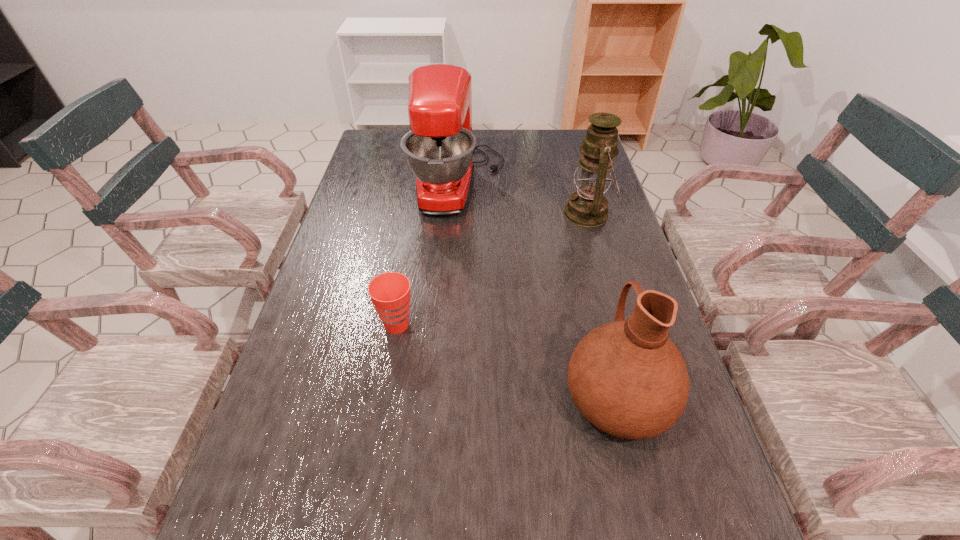
The image size is (960, 540). Identify the location of kitchen mixer. (439, 149).

The image size is (960, 540). What are the coordinates of `oil lamp` in the screenshot? It's located at (587, 207).

Find the location of a particular element. The width and height of the screenshot is (960, 540). pitcher is located at coordinates (627, 378).

I want to click on the shortest object, so click(390, 293).

Find the location of a particular element. cup is located at coordinates (390, 293).

Find the location of a particular element. This screenshot has height=540, width=960. vacant region located on the front-facing side of the kitchen mixer is located at coordinates pyautogui.click(x=598, y=184).

Locate an element on the screen. The height and width of the screenshot is (540, 960). free spot located on the front of the oil lamp is located at coordinates click(x=599, y=252).

Find the location of `vacant space located on the side of the pitcher with the handle`. vacant space located on the side of the pitcher with the handle is located at coordinates [580, 244].

Where is `vacant region located 0.060m on the side of the pitcher with the handle`? The width and height of the screenshot is (960, 540). vacant region located 0.060m on the side of the pitcher with the handle is located at coordinates (600, 327).

You are a GUI agent. You are given a task and a screenshot of the screen. Output one action in this format:
    pyautogui.click(x=<x>, y=<y>)
    Task: Click on the vacant space positioned 0.280m on the side of the pitcher with the handle
    The width and height of the screenshot is (960, 540).
    Given the screenshot: What is the action you would take?
    pyautogui.click(x=584, y=261)